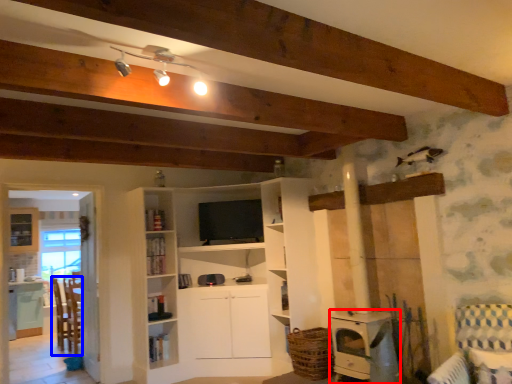
Question: Among these objects, which one is nearest to the camera, appliance (highlighted by a red box) or chair (highlighted by a blue box)?

Choices:
 (A) appliance
 (B) chair

Answer: (A)